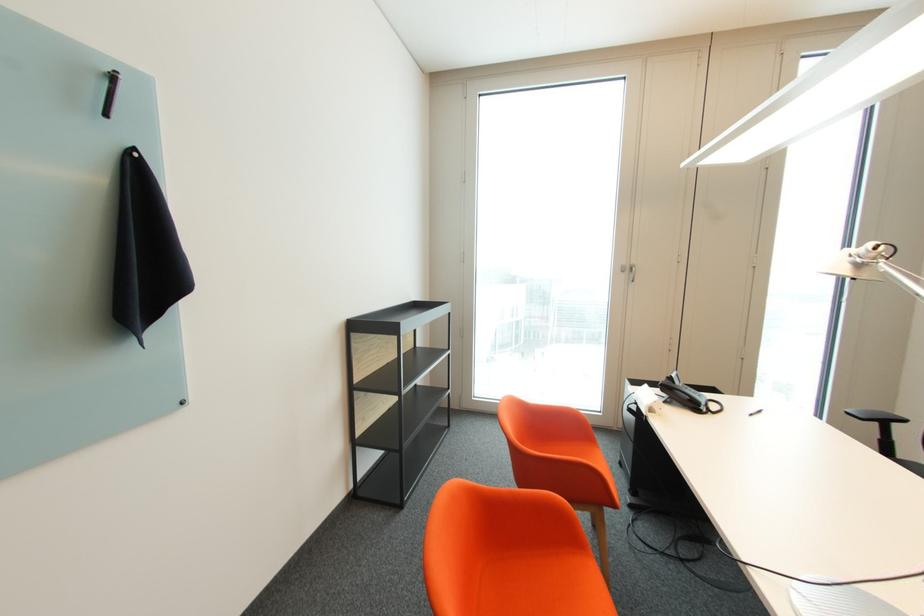
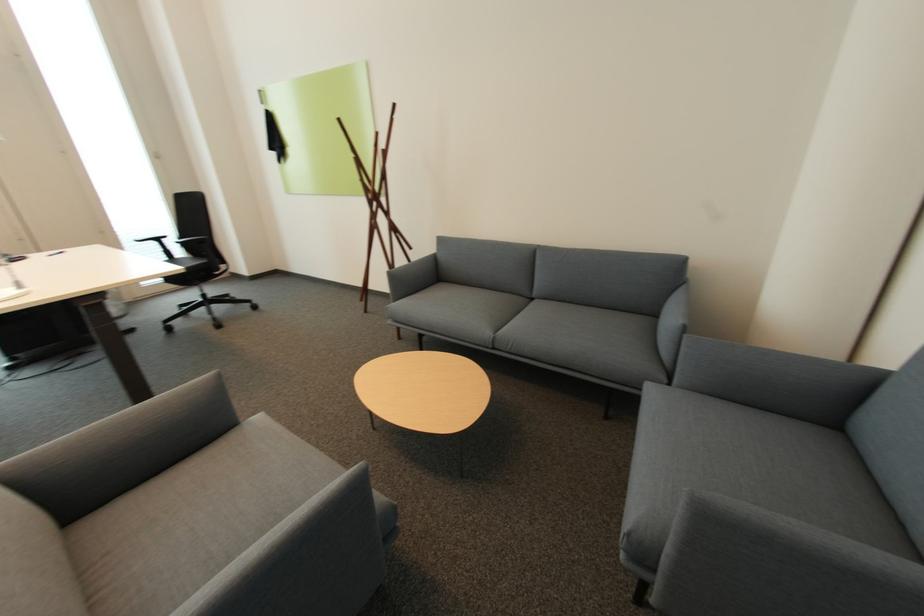
In the second image, find the point that corresponds to (857,411) in the first image.

(144, 238)